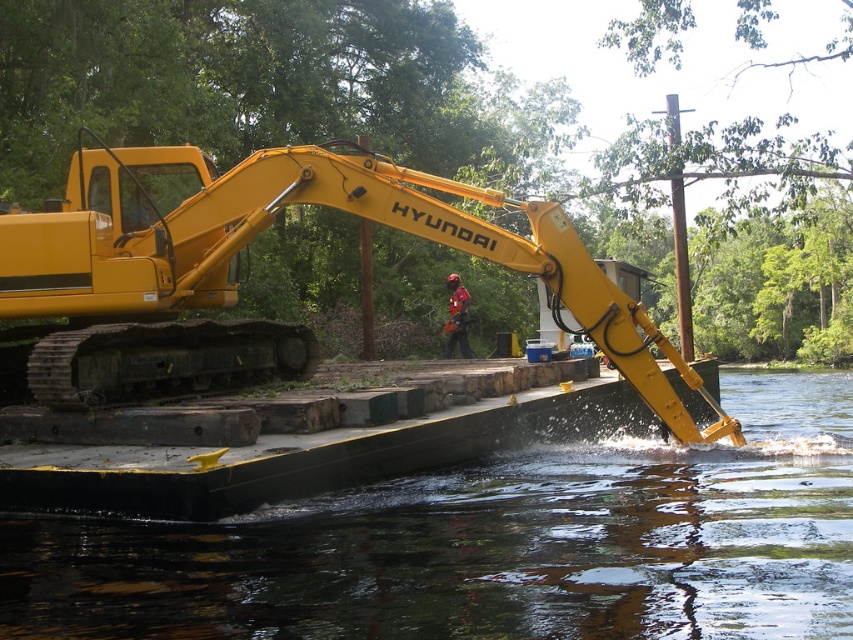
Question: Which point appears farthest from the camera in this image?

Choices:
 (A) (93, 300)
 (B) (329, 604)

Answer: (A)

Question: Does black rubber boat at lower center have a lesser width compared to yellow rubber track at center?

Choices:
 (A) yes
 (B) no

Answer: (B)

Question: Observing the image, what is the correct spatial positioning of black rubber boat at lower center in reference to yellow rubber track at center?

Choices:
 (A) left
 (B) right

Answer: (B)

Question: Which point is closer to the camera?

Choices:
 (A) (601, 280)
 (B) (334, 536)

Answer: (B)

Question: Does black rubber boat at lower center have a smaller size compared to yellow rubber track at center?

Choices:
 (A) yes
 (B) no

Answer: (A)